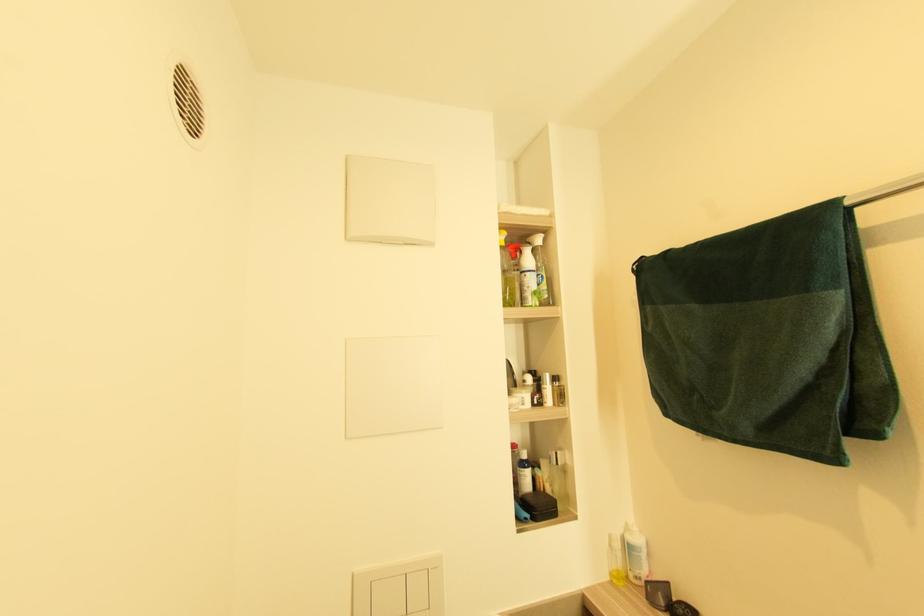
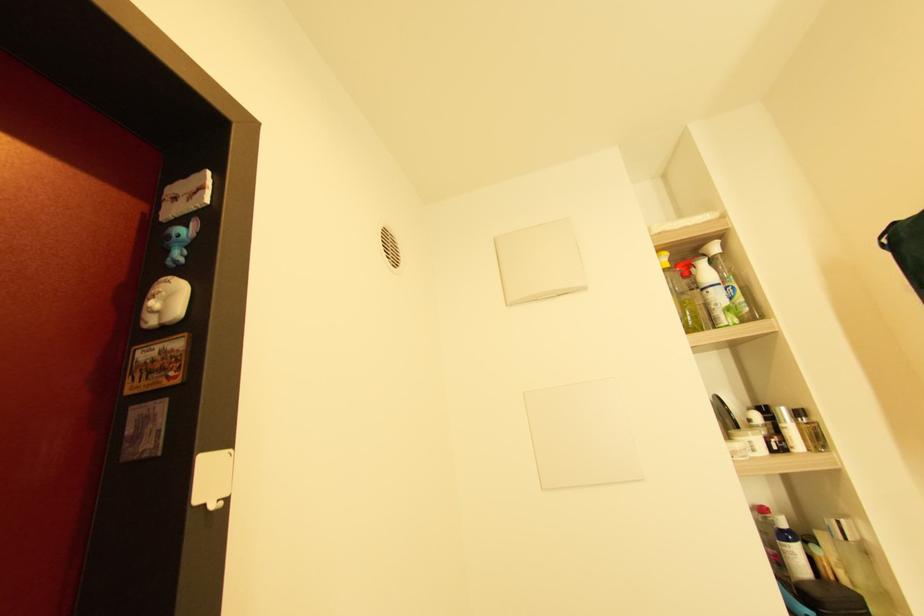
Question: The camera is either moving clockwise (left) or counter-clockwise (right) around the object. The first image is from the beginning of the video and the second image is from the end. Is the camera moving left or right when shooting the video?

Choices:
 (A) Left
 (B) Right

Answer: (B)